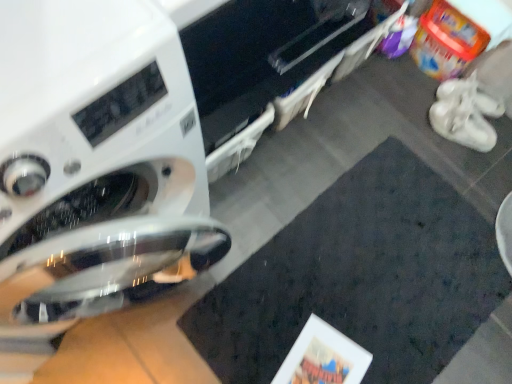
This screenshot has height=384, width=512. What are the coordinates of `vacant area that lies between white matte shoe at right and dark matte mat at center` in the screenshot? It's located at (426, 162).